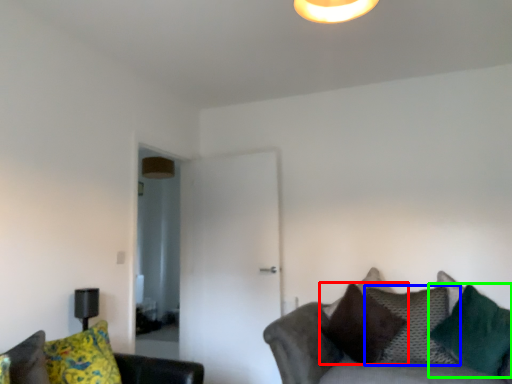
Question: Based on their relative distances, which object is nearer to pillow (highlighted by a red box)? Choose from pillow (highlighted by a blue box) and pillow (highlighted by a green box).

Choices:
 (A) pillow
 (B) pillow

Answer: (A)